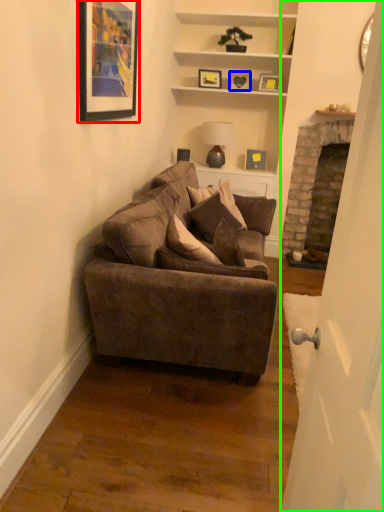
Question: Which object is positioned farthest from picture frame (highlighted by a red box)? Select from picture frame (highlighted by a blue box) and door (highlighted by a green box).

Choices:
 (A) picture frame
 (B) door

Answer: (A)